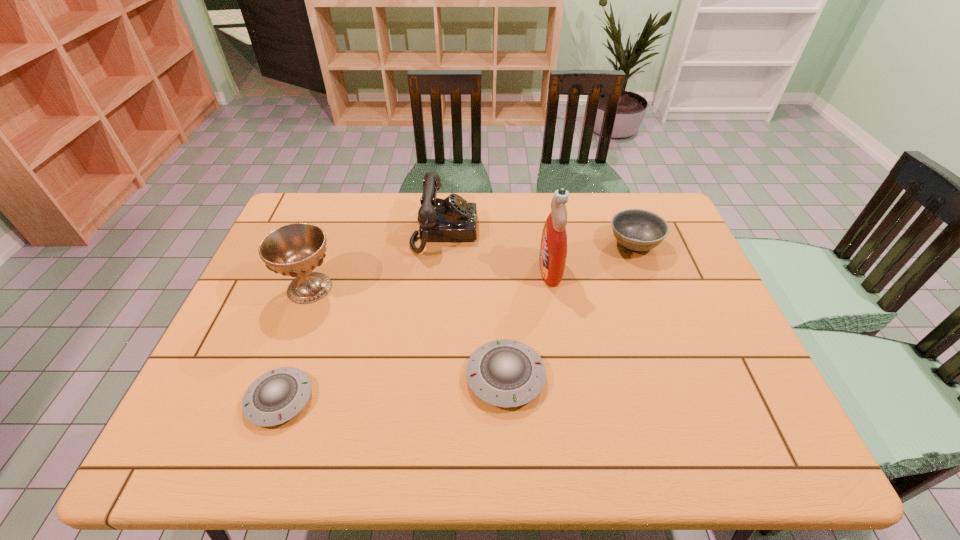
The width and height of the screenshot is (960, 540). What are the coordinates of `saucer present at the left edge` in the screenshot? It's located at (278, 395).

Where is `chalice that is at the left edge`? This screenshot has height=540, width=960. chalice that is at the left edge is located at coordinates (295, 250).

Where is `object present at the right edge`? object present at the right edge is located at coordinates (637, 230).

Where is `object that is at the near left corner`? object that is at the near left corner is located at coordinates (278, 395).

Where is `object at the far right corner`? object at the far right corner is located at coordinates (637, 230).

The height and width of the screenshot is (540, 960). In the image, there is a desktop. Find the location of `free space at the far edge`. free space at the far edge is located at coordinates (337, 215).

Locate an element on the screen. Image resolution: width=960 pixels, height=540 pixels. free space at the near edge of the desktop is located at coordinates (650, 396).

Find the location of a particular element. vacant point at the left edge is located at coordinates (268, 270).

The image size is (960, 540). Find the location of `vacant position at the far left corner of the desktop`. vacant position at the far left corner of the desktop is located at coordinates pyautogui.click(x=327, y=211).

Find the location of `vacant space at the near left corner of the desktop`. vacant space at the near left corner of the desktop is located at coordinates pyautogui.click(x=221, y=384).